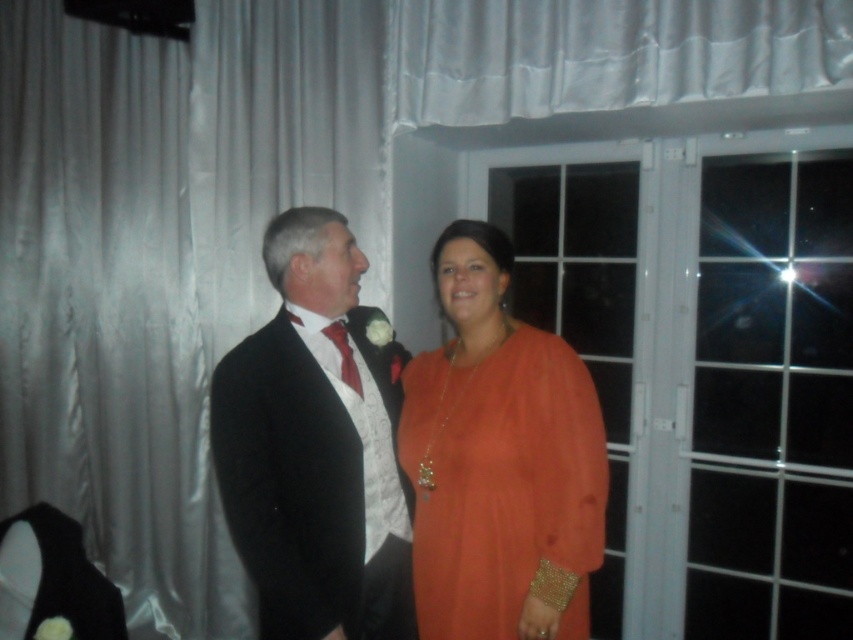
You are a photographer setting up for an event. You see the shiny black suit at center and the satin white curtain at upper center. Which object is larger in the image?

The shiny black suit at center is smaller than the satin white curtain at upper center, so the satin white curtain at upper center is larger.

You are a photographer setting up for a group photo at an event. You need to ensure that the silvery satin curtain at left is within the frame. Given that the camera has a standard field of view, can you confirm if the curtain is positioned within the camera frame?

The silvery satin curtain at left is positioned at point [163,260], which is within the camera frame.